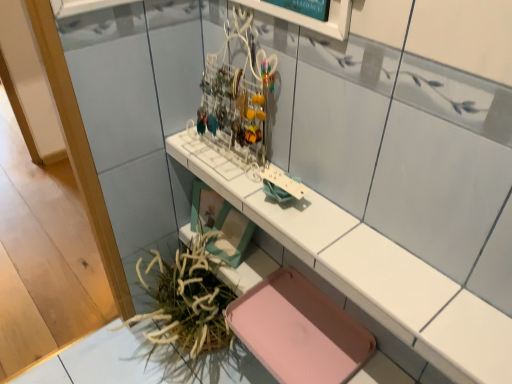
What do you see at coordinates (375, 276) in the screenshot? I see `white glossy counter at center` at bounding box center [375, 276].

This screenshot has height=384, width=512. Identify the location of white glossy counter at center. (375, 276).

Where is `green leafy plant at lower left`? green leafy plant at lower left is located at coordinates (187, 301).

Which of these two, white glossy counter at center or green leafy plant at lower left, stands shorter?

white glossy counter at center is shorter.

Is there a large distance between white glossy counter at center and green leafy plant at lower left?

No, there isn't a large distance between white glossy counter at center and green leafy plant at lower left.

Measure the distance between white glossy counter at center and green leafy plant at lower left.

white glossy counter at center is 19.65 inches away from green leafy plant at lower left.

Measure the distance between white glossy counter at center and pink matte tray at lower center.

white glossy counter at center and pink matte tray at lower center are 14.19 inches apart.

Can pink matte tray at lower center be found inside white glossy counter at center?

No.

Consider the image. In terms of size, does white glossy counter at center appear bigger or smaller than pink matte tray at lower center?

white glossy counter at center is bigger than pink matte tray at lower center.

Considering the relative sizes of pink matte tray at lower center and white glossy counter at center in the image provided, is pink matte tray at lower center shorter than white glossy counter at center?

Correct, pink matte tray at lower center is not as tall as white glossy counter at center.

Is pink matte tray at lower center next to white glossy counter at center and touching it?

No.

Between pink matte tray at lower center and white glossy counter at center, which one has smaller width?

white glossy counter at center is thinner.

Which is closer to the camera, (165,320) or (265,336)?

Point (165,320) appears to be farther away from the viewer than point (265,336).

Are green leafy plant at lower left and pink matte tray at lower center far apart?

No, green leafy plant at lower left is not far away from pink matte tray at lower center.

From the image's perspective, is pink matte tray at lower center positioned above or below green leafy plant at lower left?

Clearly, from the image's perspective, pink matte tray at lower center is above green leafy plant at lower left.

Is pink matte tray at lower center aimed at green leafy plant at lower left?

No, pink matte tray at lower center is not aimed at green leafy plant at lower left.

Would you consider pink matte tray at lower center to be distant from green leafy plant at lower left?

That's not correct — pink matte tray at lower center is a little close to green leafy plant at lower left.

How different are the orientations of green leafy plant at lower left and white glossy counter at center in degrees?

The angle between the facing direction of green leafy plant at lower left and the facing direction of white glossy counter at center is 0.756 degrees.

Considering the sizes of objects green leafy plant at lower left and white glossy counter at center in the image provided, who is thinner, green leafy plant at lower left or white glossy counter at center?

white glossy counter at center is thinner.

Is green leafy plant at lower left to the right of white glossy counter at center from the viewer's perspective?

In fact, green leafy plant at lower left is to the left of white glossy counter at center.

From a real-world perspective, is green leafy plant at lower left physically located above or below white glossy counter at center?

green leafy plant at lower left is situated lower than white glossy counter at center in the real world.

Image resolution: width=512 pixels, height=384 pixels. I want to click on counter above the green leafy plant at lower left (from the image's perspective), so click(x=375, y=276).

Where is `chair below the white glossy counter at center (from the image's perspective)`? This screenshot has width=512, height=384. chair below the white glossy counter at center (from the image's perspective) is located at coordinates (298, 331).

From the image, which object appears to be farther from pink matte tray at lower center, green leafy plant at lower left or white glossy counter at center?

The object further to pink matte tray at lower center is white glossy counter at center.

From the image, which object appears to be nearer to pink matte tray at lower center, white glossy counter at center or green leafy plant at lower left?

Based on the image, green leafy plant at lower left appears to be nearer to pink matte tray at lower center.

From the picture: Based on their spatial positions, is green leafy plant at lower left or pink matte tray at lower center closer to white glossy counter at center?

Among the two, pink matte tray at lower center is located nearer to white glossy counter at center.

Estimate the real-world distances between objects in this image. Which object is further from green leafy plant at lower left, white glossy counter at center or pink matte tray at lower center?

white glossy counter at center.

Based on their spatial positions, is pink matte tray at lower center or green leafy plant at lower left further from white glossy counter at center?

green leafy plant at lower left is positioned further to the anchor white glossy counter at center.

Based on their spatial positions, is pink matte tray at lower center or white glossy counter at center further from green leafy plant at lower left?

white glossy counter at center.

Locate an element on the screen. The image size is (512, 384). counter between green leafy plant at lower left and pink matte tray at lower center in the horizontal direction is located at coordinates (375, 276).